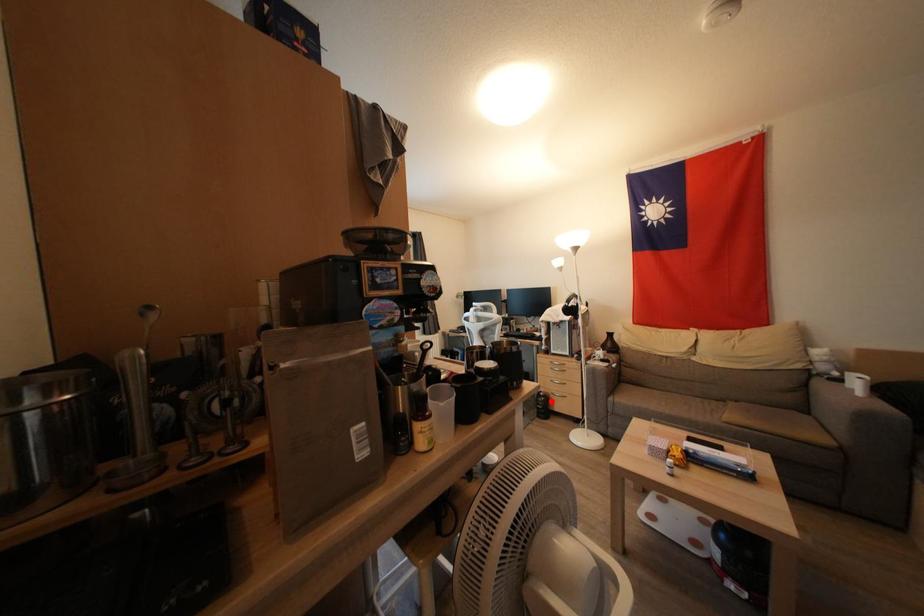
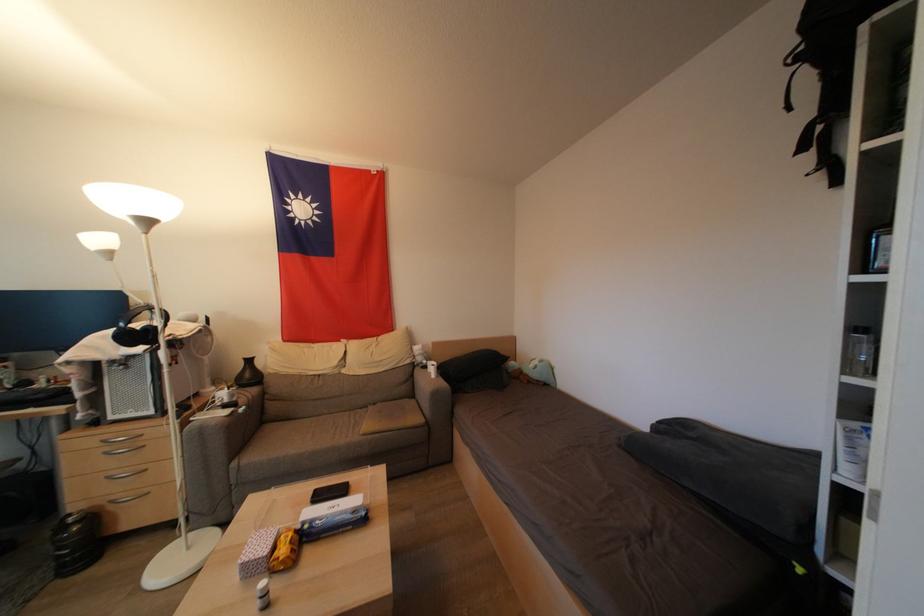
Question: I am providing you with two images of the same scene from different viewpoints. Image1 has a red point marked. In image2, the corresponding 3D location appears at what relative position? Reply with the corresponding letter.

Choices:
 (A) Closer
 (B) Farther

Answer: (A)